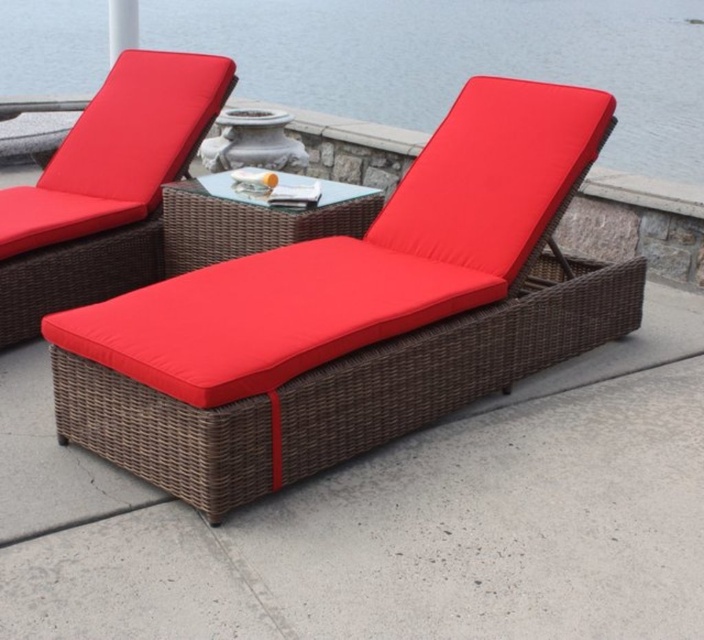
Question: Which point is farther to the camera?

Choices:
 (A) (631, 156)
 (B) (15, 268)
 (C) (158, 401)

Answer: (A)

Question: Among these points, which one is nearest to the camera?

Choices:
 (A) (458, 10)
 (B) (199, 109)
 (C) (258, 333)

Answer: (C)

Question: Estimate the real-world distances between objects in this image. Which object is farther from the transparent glass water at upper center?

Choices:
 (A) brown wicker chaise lounge at center
 (B) matte wicker chaise at upper left

Answer: (A)

Question: Does brown wicker chaise lounge at center have a greater width compared to transparent glass water at upper center?

Choices:
 (A) yes
 (B) no

Answer: (A)

Question: Does brown wicker chaise lounge at center appear over matte wicker chaise at upper left?

Choices:
 (A) no
 (B) yes

Answer: (A)

Question: In this image, where is transparent glass water at upper center located relative to matte wicker chaise at upper left?

Choices:
 (A) above
 (B) below

Answer: (A)